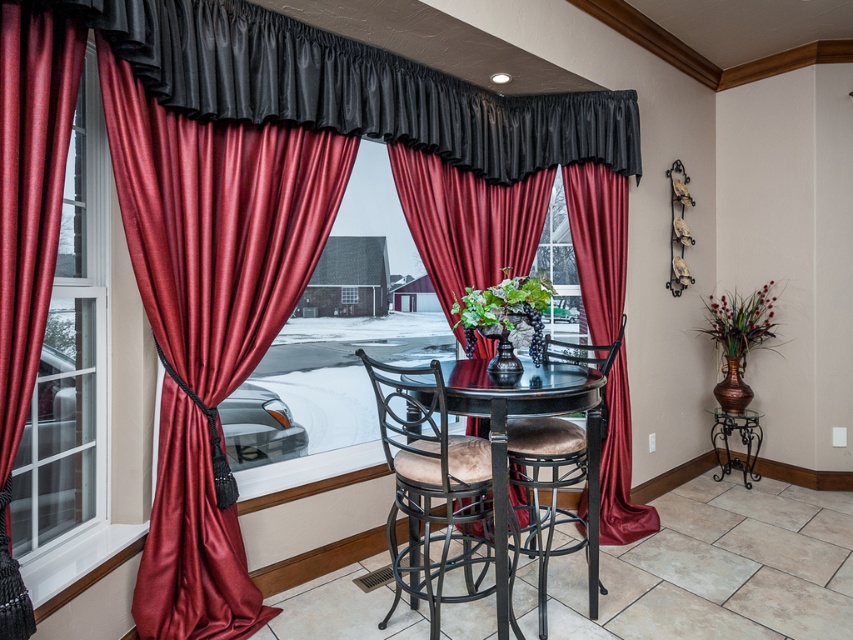
Is point (601, 275) more distant than point (401, 420)?

Yes.

Does point (524, 237) come farther from viewer compared to point (431, 477)?

Yes, it is behind point (431, 477).

At what (x,y) coordinates should I click in order to perform the action: click on satin red curtain at center. Please return your answer as a coordinate pair (x, y). Image resolution: width=853 pixels, height=640 pixels. Looking at the image, I should click on (467, 220).

Is satin curtain at left to the right of velvet tan chair at center from the viewer's perspective?

In fact, satin curtain at left is to the left of velvet tan chair at center.

Is point (22, 500) in front of point (474, 515)?

Yes, it is.

Measure the distance between point (97, 148) and camera.

Point (97, 148) and camera are 2.13 meters apart.

Locate an element on the screen. This screenshot has width=853, height=640. satin curtain at left is located at coordinates (68, 349).

Which is in front, point (300, 221) or point (614, 424)?

Point (300, 221)

Is satin red curtains at left bigger than satin red curtain at center?

Incorrect, satin red curtains at left is not larger than satin red curtain at center.

Who is more distant from viewer, (x=198, y=216) or (x=602, y=509)?

The point (x=602, y=509) is behind.

The height and width of the screenshot is (640, 853). Identify the location of satin red curtains at left. (210, 320).